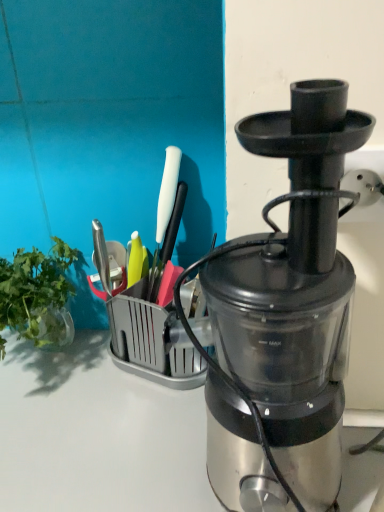
Question: From a real-world perspective, is green leafy vegetable at left positioned under metallic silver blender at center based on gravity?

Choices:
 (A) no
 (B) yes

Answer: (B)

Question: Considering the relative sizes of green leafy vegetable at left and metallic silver blender at center in the image provided, is green leafy vegetable at left shorter than metallic silver blender at center?

Choices:
 (A) no
 (B) yes

Answer: (B)

Question: Can you confirm if green leafy vegetable at left is wider than metallic silver blender at center?

Choices:
 (A) no
 (B) yes

Answer: (B)

Question: Is green leafy vegetable at left far away from metallic silver blender at center?

Choices:
 (A) yes
 (B) no

Answer: (B)

Question: Could metallic silver blender at center be considered to be inside green leafy vegetable at left?

Choices:
 (A) yes
 (B) no

Answer: (B)

Question: Is the position of green leafy vegetable at left less distant than that of metallic silver blender at center?

Choices:
 (A) no
 (B) yes

Answer: (A)

Question: Is metallic silver blender at center oriented towards green leafy vegetable at left?

Choices:
 (A) no
 (B) yes

Answer: (A)

Question: Does metallic silver blender at center have a lesser width compared to green leafy vegetable at left?

Choices:
 (A) no
 (B) yes

Answer: (B)

Question: From a real-world perspective, does metallic silver blender at center stand above green leafy vegetable at left?

Choices:
 (A) no
 (B) yes

Answer: (B)

Question: Is metallic silver blender at center bigger than green leafy vegetable at left?

Choices:
 (A) no
 (B) yes

Answer: (B)

Question: Can you confirm if metallic silver blender at center is positioned to the left of green leafy vegetable at left?

Choices:
 (A) no
 (B) yes

Answer: (A)

Question: Is green leafy vegetable at left a part of metallic silver blender at center?

Choices:
 (A) no
 (B) yes

Answer: (A)

Question: From the image's perspective, relative to green leafy vegetable at left, is metallic silver blender at center above or below?

Choices:
 (A) below
 (B) above

Answer: (B)